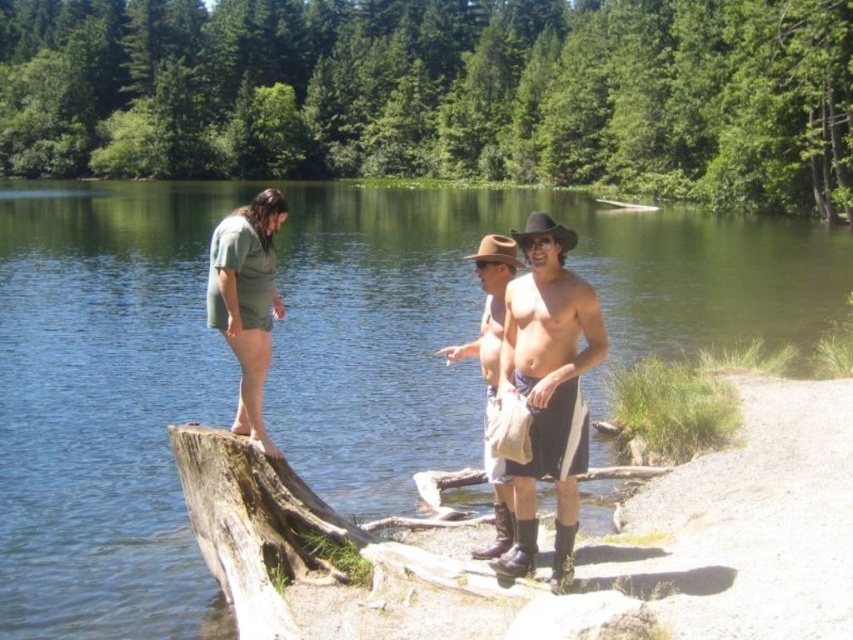
You are standing on the brown rough wood at lower left and want to reach the brown leather cowboy boots at center. Is the path between them clear?

The brown rough wood at lower left is located below brown leather cowboy boots at center, so the path between them is clear as the boots are above the wood.

You are a hiker who wants to cross the lake using the brown rough wood log at lower center and the brown rough wood at lower left. Which one is wider and better to step on?

The brown rough wood log at lower center is wider than the brown rough wood at lower left, so it is better to step on the brown rough wood log at lower center.